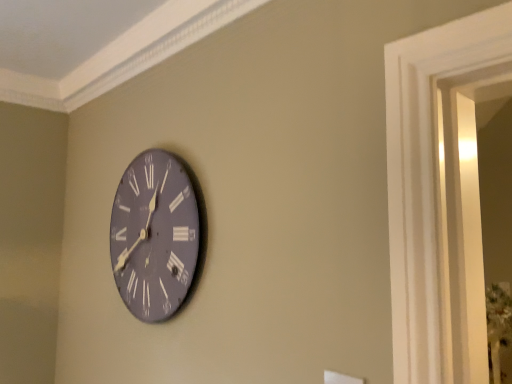
Describe the element at coordinates (155, 235) in the screenshot. I see `matte gray clock at center-left` at that location.

In order to face matte gray clock at center-left, should I rotate leftwards or rightwards?

A 16.132 degree turn to the left will do.

This screenshot has width=512, height=384. Identify the location of matte gray clock at center-left. (155, 235).

You are a GUI agent. You are given a task and a screenshot of the screen. Output one action in this format:
    pyautogui.click(x=<x>, y=<y>)
    Task: Click on the matte gray clock at center-left
    
    Given the screenshot: What is the action you would take?
    pyautogui.click(x=155, y=235)